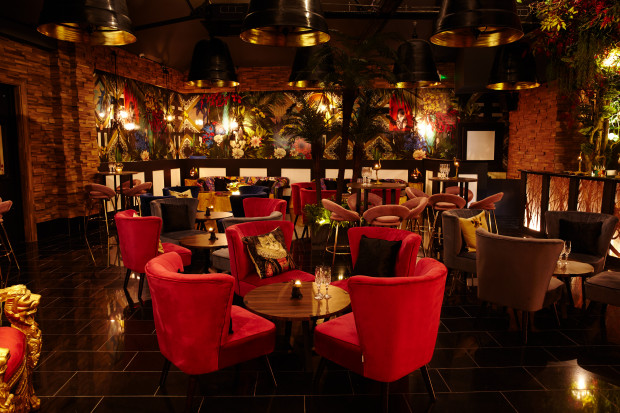
Locate an element on the screen. stemmed glasses is located at coordinates (325, 277), (317, 277).